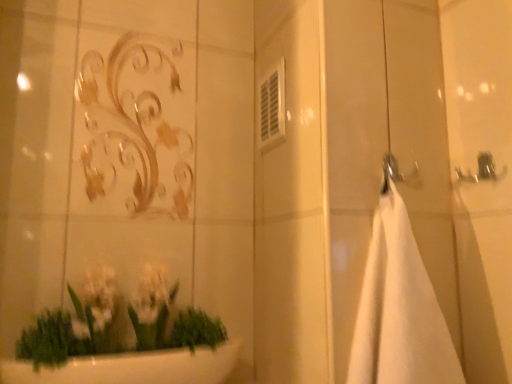
Question: Looking at their shapes, would you say white matte towel at right is wider or thinner than white glossy plant at lower left?

Choices:
 (A) wide
 (B) thin

Answer: (B)

Question: Do you think white matte towel at right is within white glossy plant at lower left, or outside of it?

Choices:
 (A) outside
 (B) inside

Answer: (A)

Question: Looking at the image, does white matte towel at right seem bigger or smaller compared to white glossy plant at lower left?

Choices:
 (A) big
 (B) small

Answer: (B)

Question: Based on their positions, is white glossy plant at lower left located to the left or right of white matte towel at right?

Choices:
 (A) left
 (B) right

Answer: (A)

Question: In terms of height, does white glossy plant at lower left look taller or shorter compared to white matte towel at right?

Choices:
 (A) tall
 (B) short

Answer: (B)

Question: From the image's perspective, is white glossy plant at lower left positioned above or below white matte towel at right?

Choices:
 (A) above
 (B) below

Answer: (B)

Question: In terms of width, does white glossy plant at lower left look wider or thinner when compared to white matte towel at right?

Choices:
 (A) thin
 (B) wide

Answer: (B)